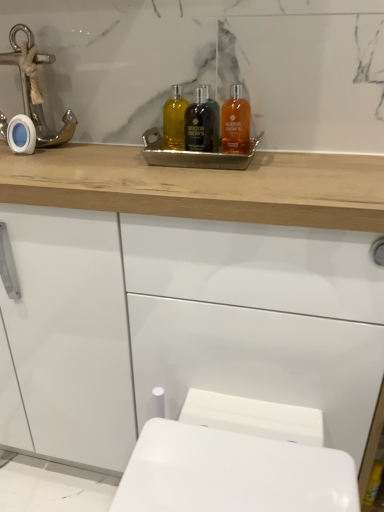
Where is `vacant area that lies to the right of translucent amber liquid at upper center, the third mouthwash viewed from the left`? vacant area that lies to the right of translucent amber liquid at upper center, the third mouthwash viewed from the left is located at coordinates (320, 158).